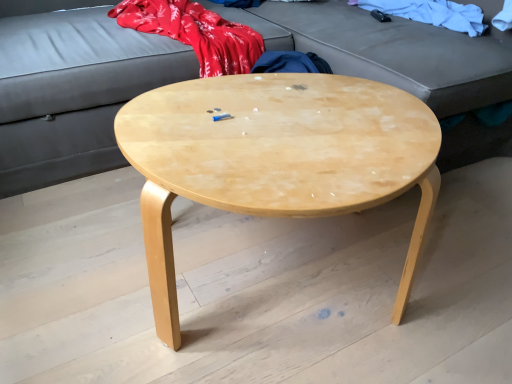
Question: From the image's perspective, relative to matte gray studio couch at upper center, is natural wood coffee table at center above or below?

Choices:
 (A) above
 (B) below

Answer: (B)

Question: In terms of size, does natural wood coffee table at center appear bigger or smaller than matte gray studio couch at upper center?

Choices:
 (A) small
 (B) big

Answer: (A)

Question: Based on their relative distances, which object is nearer to the matte gray studio couch at upper center?

Choices:
 (A) natural wood coffee table at center
 (B) white cotton cloth at upper right

Answer: (B)

Question: Considering the real-world distances, which object is farthest from the matte gray studio couch at upper center?

Choices:
 (A) natural wood coffee table at center
 (B) white cotton cloth at upper right

Answer: (A)